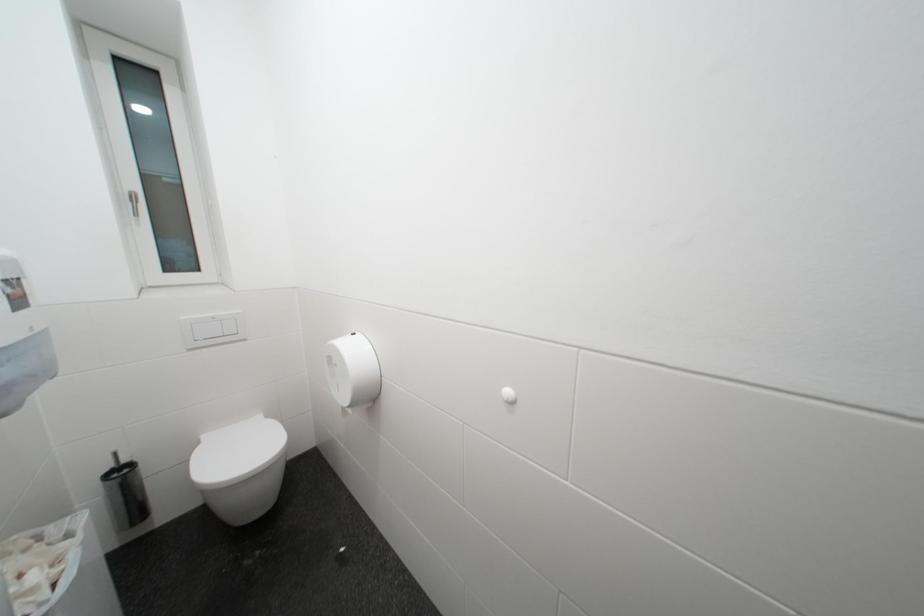
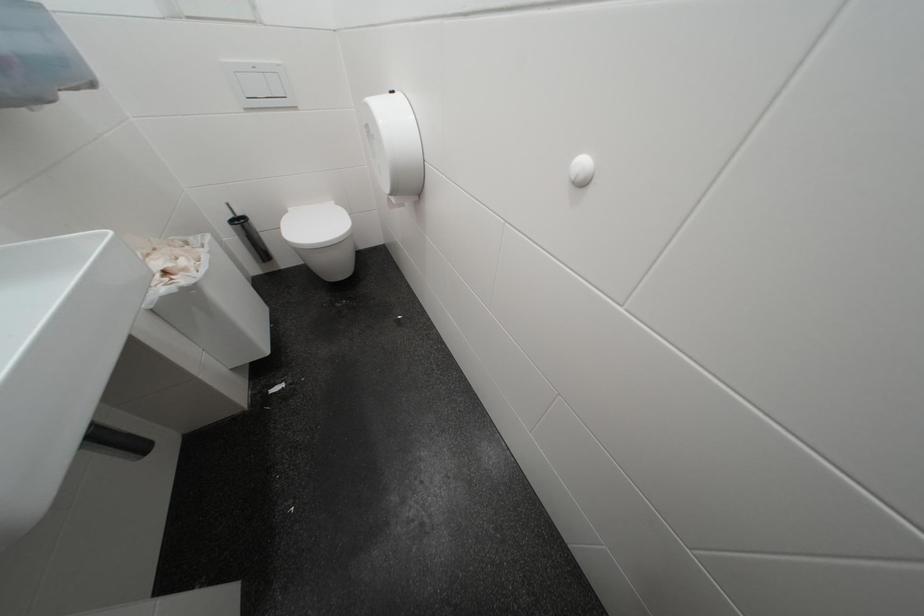
The first image is from the beginning of the video and the second image is from the end. How did the camera likely rotate when shooting the video?

The camera rotated toward left-down.